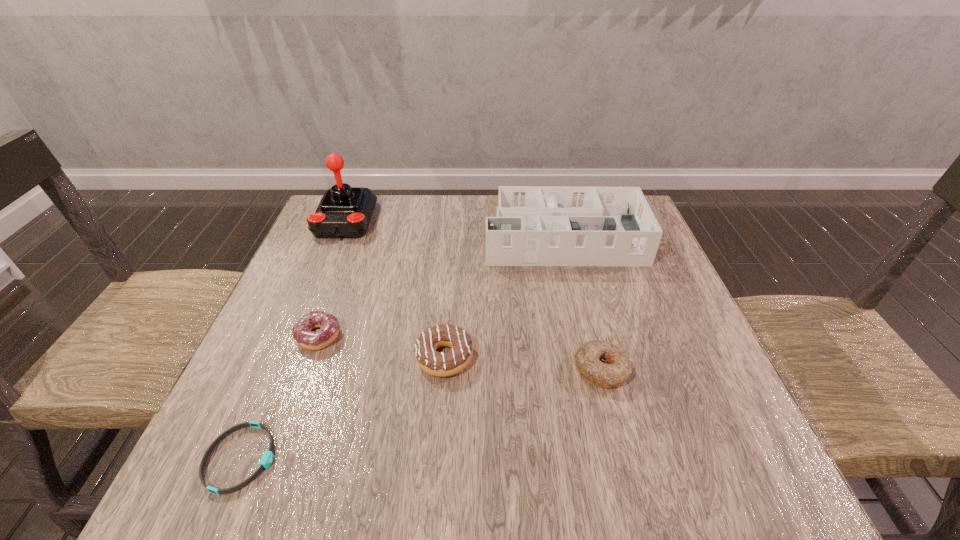
At what (x,y) coordinates should I click in order to perform the action: click on object situated at the far left corner. Please return your answer as a coordinate pair (x, y). This screenshot has height=540, width=960. Looking at the image, I should click on (344, 212).

You are a GUI agent. You are given a task and a screenshot of the screen. Output one action in this format:
    pyautogui.click(x=<x>, y=<y>)
    Task: Click on the object that is at the near left corner
    Image resolution: width=960 pixels, height=540 pixels.
    Given the screenshot: What is the action you would take?
    pyautogui.click(x=267, y=458)

Where is `object located in the far right corner section of the desktop`? The height and width of the screenshot is (540, 960). object located in the far right corner section of the desktop is located at coordinates (535, 225).

Image resolution: width=960 pixels, height=540 pixels. I want to click on free point at the far edge, so click(388, 202).

You are a GUI agent. You are given a task and a screenshot of the screen. Output one action in this format:
    pyautogui.click(x=<x>, y=<y>)
    Task: Click on the free region at the left edge of the desktop
    This screenshot has width=960, height=540.
    Given the screenshot: What is the action you would take?
    pyautogui.click(x=298, y=264)

This screenshot has height=540, width=960. In order to click on vacant space at the right edge in this screenshot , I will do pos(642,337).

What are the coordinates of `blank space at the near left corner of the desktop` in the screenshot? It's located at (297, 457).

Image resolution: width=960 pixels, height=540 pixels. In order to click on vacant area between the leftmost doughnut and the shortest object in this screenshot , I will do `click(279, 397)`.

I want to click on empty location between the nearest object and the third object from right to left, so click(343, 408).

Where is `vacant point located between the leftmost doughnut and the joystick`? The height and width of the screenshot is (540, 960). vacant point located between the leftmost doughnut and the joystick is located at coordinates (332, 279).